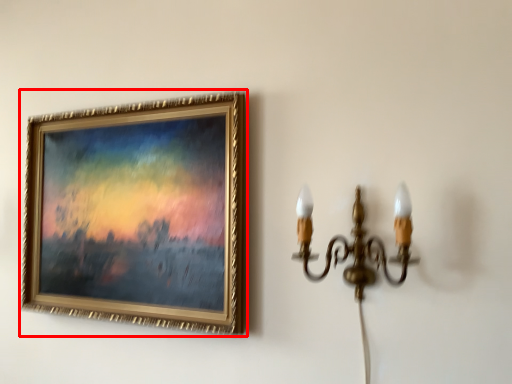
Question: Considering the relative positions of picture frame (annotated by the red box) and lamp in the image provided, where is picture frame (annotated by the red box) located with respect to the staircase?

Choices:
 (A) right
 (B) left

Answer: (B)